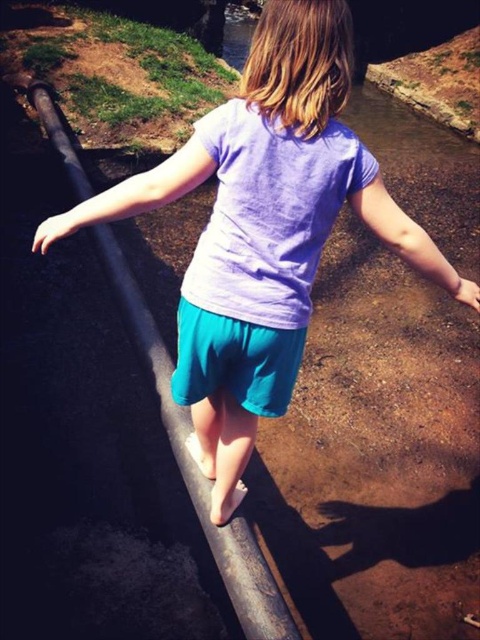
Question: Does smooth metal rail at center have a greater width compared to teal fabric shorts at center?

Choices:
 (A) no
 (B) yes

Answer: (A)

Question: Does smooth metal rail at center appear under teal fabric shorts at center?

Choices:
 (A) yes
 (B) no

Answer: (A)

Question: Can you confirm if smooth metal rail at center is thinner than teal fabric shorts at center?

Choices:
 (A) no
 (B) yes

Answer: (B)